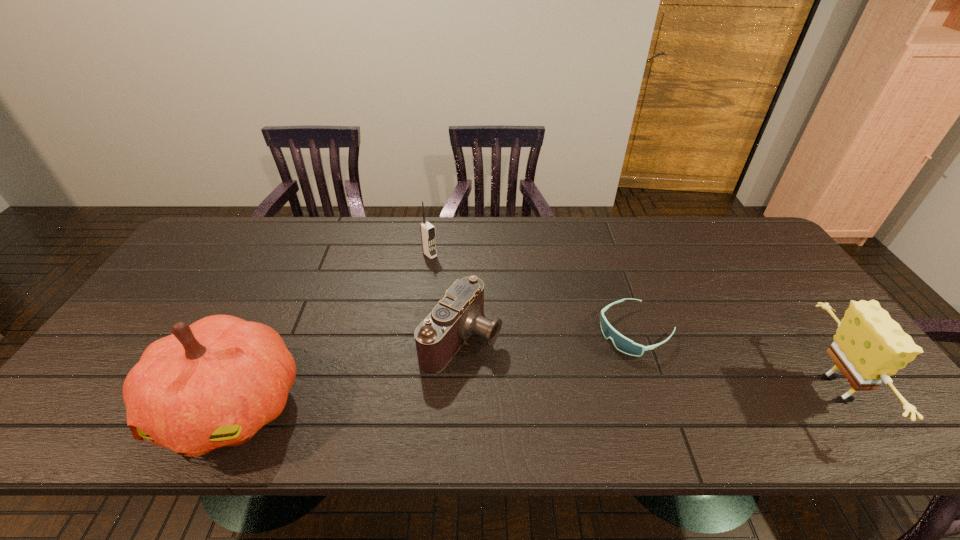
What are the coordinates of `blank region between the rightmost object and the second shortest object` in the screenshot? It's located at (650, 363).

You are a GUI agent. You are given a task and a screenshot of the screen. Output one action in this format:
    pyautogui.click(x=<x>, y=<y>)
    Task: Click on the vacant region between the fourth tallest object and the leftmost object
    
    Given the screenshot: What is the action you would take?
    click(346, 372)

You are a GUI agent. You are given a task and a screenshot of the screen. Output one action in this format:
    pyautogui.click(x=<x>, y=<y>)
    Task: Click on the free space between the third tallest object and the leftmost object
    Image resolution: width=960 pixels, height=540 pixels.
    Given the screenshot: What is the action you would take?
    pyautogui.click(x=330, y=330)

Where is `free point between the goggles and the rightmost object`? Image resolution: width=960 pixels, height=540 pixels. free point between the goggles and the rightmost object is located at coordinates (737, 360).

Where is `free space between the tallest object and the fourth tallest object`? This screenshot has width=960, height=540. free space between the tallest object and the fourth tallest object is located at coordinates point(346,372).

Find the location of a particular element. Image resolution: width=960 pixels, height=540 pixels. vacant area that lies between the pumpkin and the camera is located at coordinates (346, 372).

You are a GUI agent. You are given a task and a screenshot of the screen. Output one action in this format:
    pyautogui.click(x=<x>, y=<y>)
    Task: Click on the vacant space in between the second shortest object and the leftmost object
    This screenshot has height=540, width=960.
    Given the screenshot: What is the action you would take?
    pyautogui.click(x=346, y=372)

Identify the location of free space between the camera and the sponge. (650, 363).

Where is `the second closest object relative to the camera`? the second closest object relative to the camera is located at coordinates (214, 383).

Where is `object that stands as the second closest to the camera`? This screenshot has height=540, width=960. object that stands as the second closest to the camera is located at coordinates (214, 383).